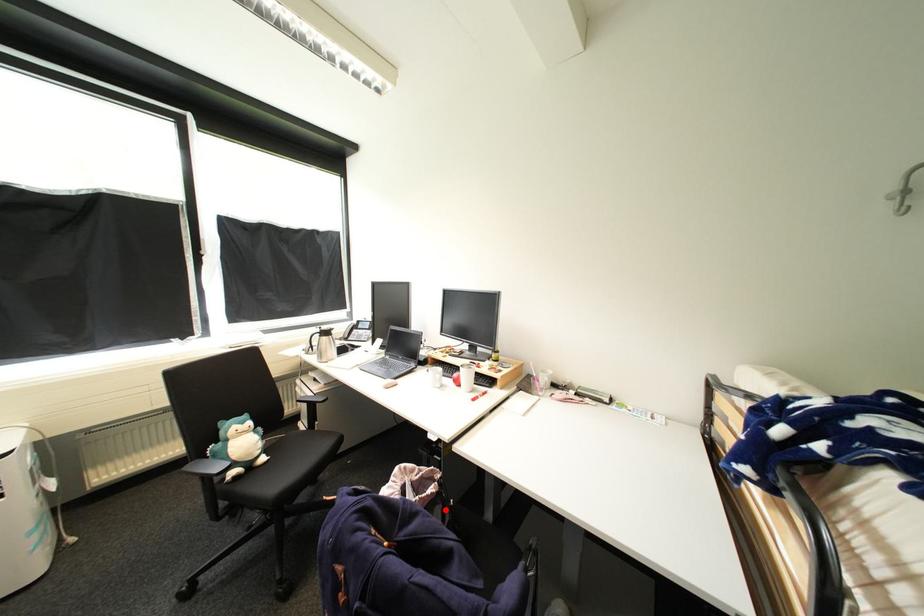
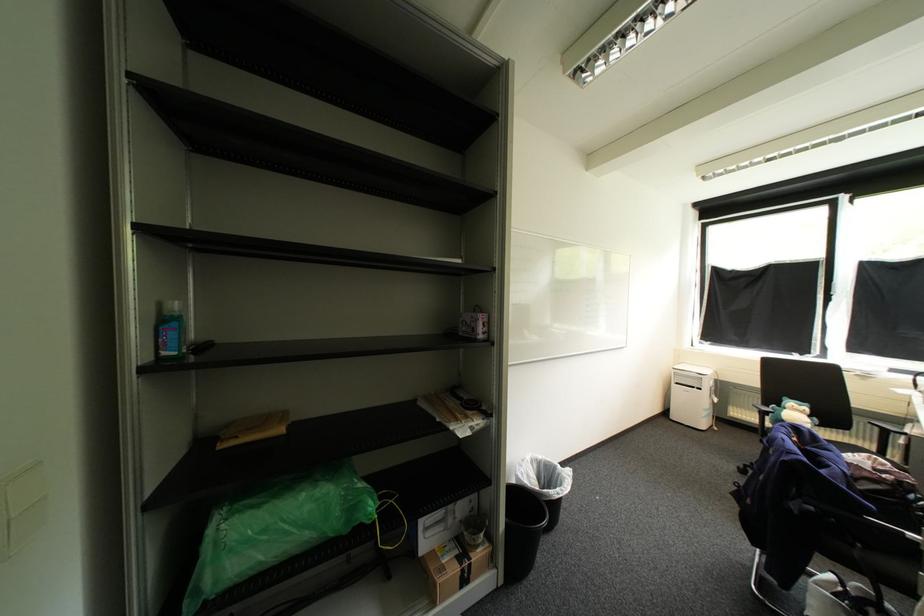
Question: A red point is marked in image1. In image2, is the corresponding 3D point closer to the camera or farther? Reply with the corresponding letter.

Choices:
 (A) The corresponding 3D point is closer.
 (B) The corresponding 3D point is farther.

Answer: (B)